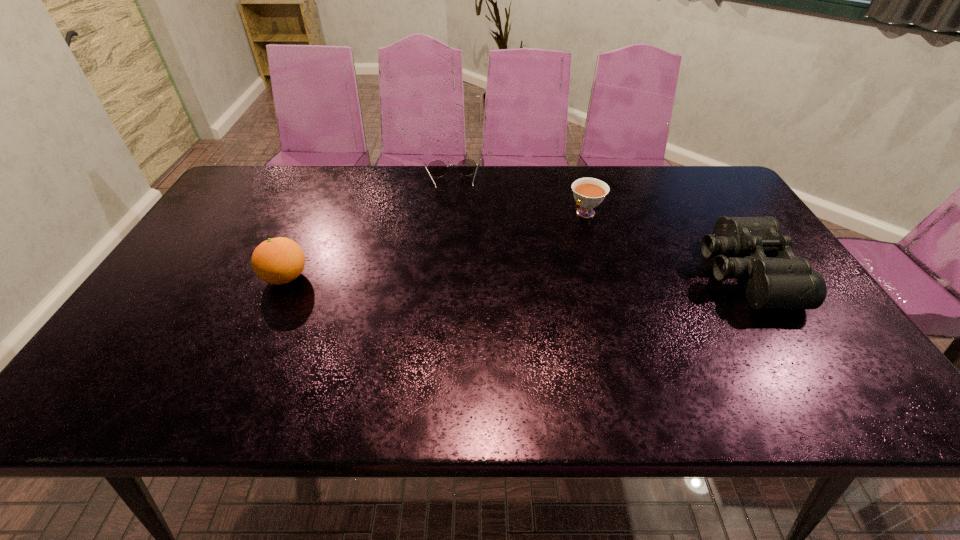
Find the location of a particular element. The height and width of the screenshot is (540, 960). empty space that is in between the teacup and the binoculars is located at coordinates (664, 243).

At what (x,y) coordinates should I click in order to perform the action: click on vacant area that lies between the second object from left to right and the second object from right to left. Please return your answer as a coordinate pair (x, y). Looking at the image, I should click on pyautogui.click(x=518, y=200).

Identify the location of free space between the leftmost object and the spectacles. coord(369,232).

The height and width of the screenshot is (540, 960). Find the location of `blank region between the orange and the third tallest object`. blank region between the orange and the third tallest object is located at coordinates (436, 245).

Image resolution: width=960 pixels, height=540 pixels. I want to click on free space that is in between the shortest object and the orange, so click(369, 232).

Locate an element on the screen. Image resolution: width=960 pixels, height=540 pixels. empty space between the second shortest object and the shortest object is located at coordinates (518, 200).

Where is `empty location between the second object from left to right and the leftmost object`? empty location between the second object from left to right and the leftmost object is located at coordinates pos(369,232).

The width and height of the screenshot is (960, 540). What are the coordinates of `vacant area that lies between the spectacles and the third tallest object` in the screenshot? It's located at (518, 200).

The height and width of the screenshot is (540, 960). In order to click on vacant area that lies between the spectacles and the second farthest object in this screenshot , I will do `click(518, 200)`.

The width and height of the screenshot is (960, 540). What are the coordinates of `free space between the third object from right to left and the third nearest object` in the screenshot? It's located at (518, 200).